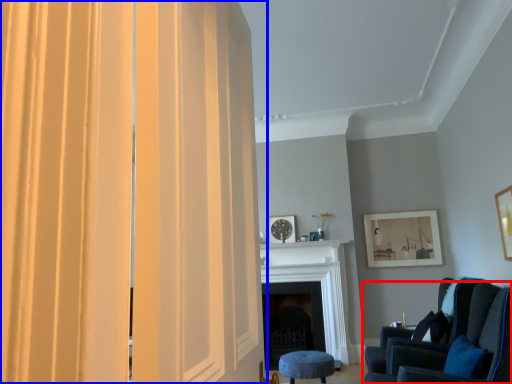
Question: Among these objects, which one is farthest to the camera, chair (highlighted by a red box) or curtain (highlighted by a blue box)?

Choices:
 (A) chair
 (B) curtain

Answer: (A)